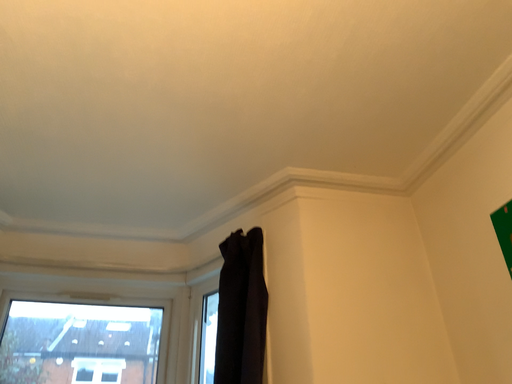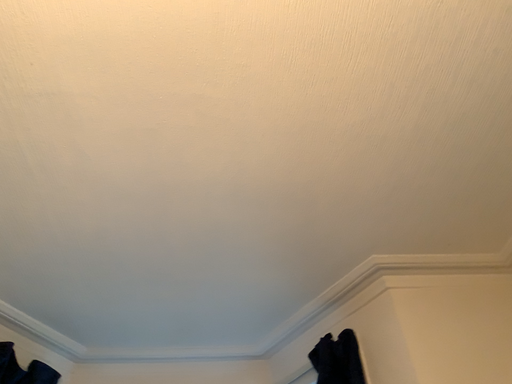
Question: How did the camera likely rotate when shooting the video?

Choices:
 (A) rotated upward
 (B) rotated downward

Answer: (A)